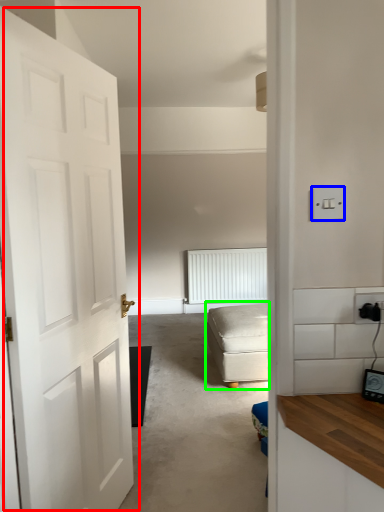
Question: Which object is the farthest from door (highlighted by a red box)? Choose among these: light switch (highlighted by a blue box) or studio couch (highlighted by a green box).

Choices:
 (A) light switch
 (B) studio couch

Answer: (B)